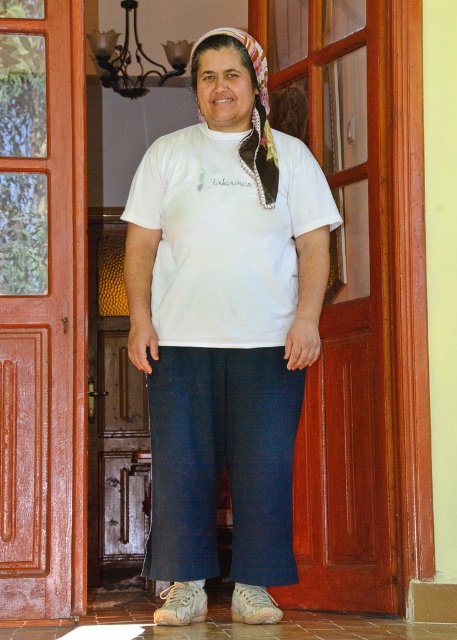
Does white cotton t-shirt at center appear on the right side of printed silk headscarf at center?

In fact, white cotton t-shirt at center is to the left of printed silk headscarf at center.

Consider the image. Does white cotton t-shirt at center have a lesser height compared to printed silk headscarf at center?

Incorrect, white cotton t-shirt at center's height does not fall short of printed silk headscarf at center's.

Does point (239, 320) come closer to viewer compared to point (270, 188)?

Yes, it is.

Identify the location of white cotton t-shirt at center. Image resolution: width=457 pixels, height=640 pixels. (224, 236).

Can you confirm if brown wooden door at center is bigger than printed silk headscarf at center?

Incorrect, brown wooden door at center is not larger than printed silk headscarf at center.

Which is more to the right, brown wooden door at center or printed silk headscarf at center?

printed silk headscarf at center is more to the right.

I want to click on brown wooden door at center, so point(42,308).

At what (x,y) coordinates should I click in order to perform the action: click on brown wooden door at center. Please return your answer as a coordinate pair (x, y). The image size is (457, 640). Looking at the image, I should click on (42, 308).

Is white cotton shirt at center to the right of white cotton t-shirt at center from the viewer's perspective?

Incorrect, white cotton shirt at center is not on the right side of white cotton t-shirt at center.

Can you confirm if white cotton shirt at center is smaller than white cotton t-shirt at center?

Incorrect, white cotton shirt at center is not smaller in size than white cotton t-shirt at center.

Which is behind, point (242, 417) or point (211, 250)?

The point (242, 417) is more distant.

This screenshot has width=457, height=640. I want to click on white cotton shirt at center, so click(x=224, y=330).